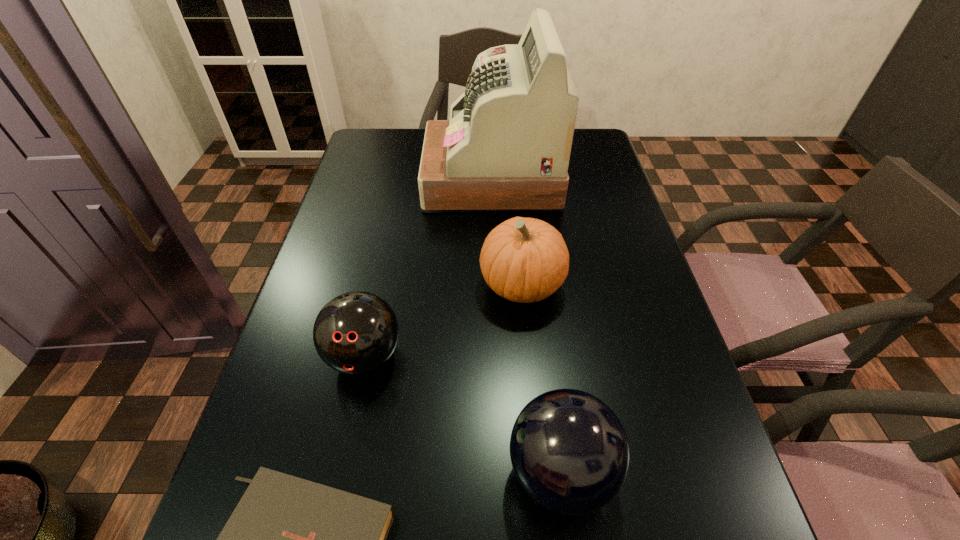
Locate an element on the screen. This screenshot has width=960, height=540. vacant space at the far left corner of the desktop is located at coordinates (406, 151).

The width and height of the screenshot is (960, 540). I want to click on vacant area between the nearer bowling ball and the fourth nearest object, so click(x=541, y=379).

The width and height of the screenshot is (960, 540). I want to click on free spot between the second farthest object and the third farthest object, so click(444, 320).

Locate an element on the screen. The image size is (960, 540). free spot between the nearer bowling ball and the cash register is located at coordinates (526, 326).

Image resolution: width=960 pixels, height=540 pixels. Identify the location of vacant point located between the third nearest object and the tallest object. (428, 267).

At what (x,y) coordinates should I click in order to perform the action: click on free space between the right bowling ball and the second farthest object. Please return your answer as a coordinate pair (x, y). This screenshot has height=540, width=960. Looking at the image, I should click on (541, 379).

This screenshot has height=540, width=960. What are the coordinates of `vacant space that is in between the nearer bowling ball and the cash register` in the screenshot? It's located at (526, 326).

Locate an element on the screen. object that stands as the closest to the left bowling ball is located at coordinates (525, 260).

Where is `the closest object to the right bowling ball`? This screenshot has height=540, width=960. the closest object to the right bowling ball is located at coordinates (289, 539).

Where is `vacant position in the image that satisfies the following two spatial constraints: 1. on the stem of the pumpkin; 2. on the surface of the farther bowling ball near the finger holes`? vacant position in the image that satisfies the following two spatial constraints: 1. on the stem of the pumpkin; 2. on the surface of the farther bowling ball near the finger holes is located at coordinates (528, 356).